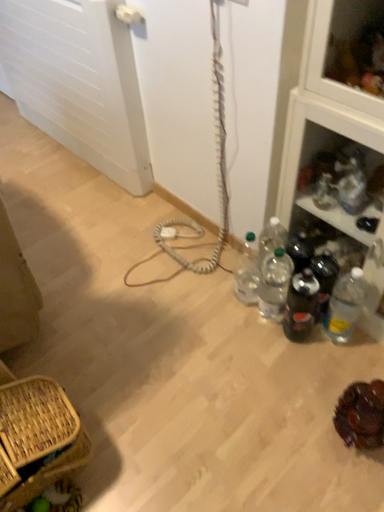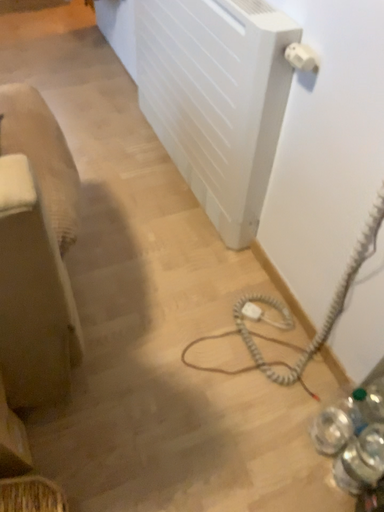
Question: How did the camera likely rotate when shooting the video?

Choices:
 (A) rotated left
 (B) rotated right

Answer: (A)